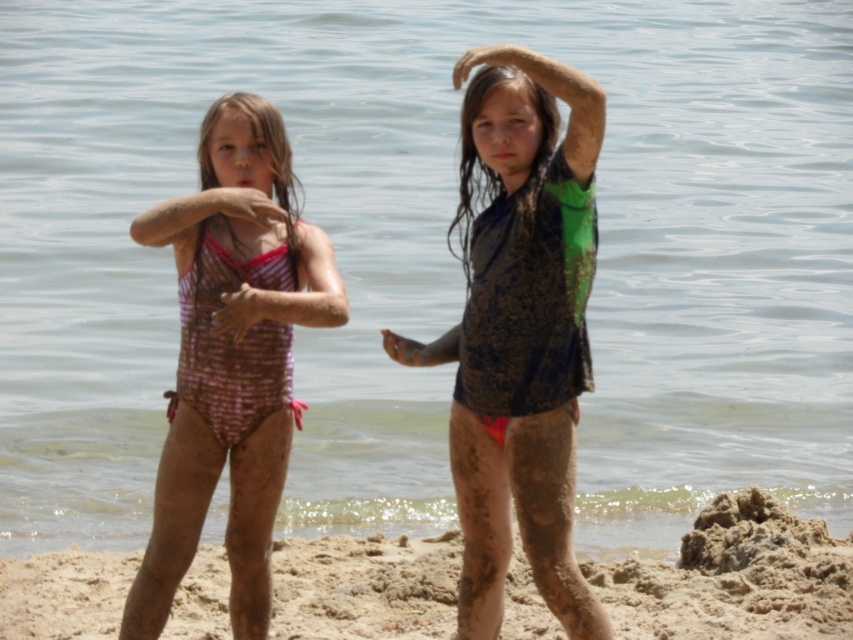
Question: Which object is positioned closest to the pink checkered swimsuit at center?

Choices:
 (A) fine-grained sand at lower center
 (B) shiny green and black swimsuit at center

Answer: (B)

Question: Which point is farther to the camera?

Choices:
 (A) fine-grained sand at lower center
 (B) pink checkered swimsuit at center
 (C) shiny green and black swimsuit at center

Answer: (A)

Question: Can you confirm if shiny green and black swimsuit at center is bigger than pink checkered swimsuit at center?

Choices:
 (A) yes
 (B) no

Answer: (A)

Question: From the image, what is the correct spatial relationship of shiny green and black swimsuit at center in relation to fine-grained sand at lower center?

Choices:
 (A) left
 (B) right

Answer: (A)

Question: Which of the following is the closest to the observer?

Choices:
 (A) shiny green and black swimsuit at center
 (B) pink checkered swimsuit at center

Answer: (A)

Question: Considering the relative positions of shiny green and black swimsuit at center and pink checkered swimsuit at center in the image provided, where is shiny green and black swimsuit at center located with respect to pink checkered swimsuit at center?

Choices:
 (A) left
 (B) right

Answer: (B)